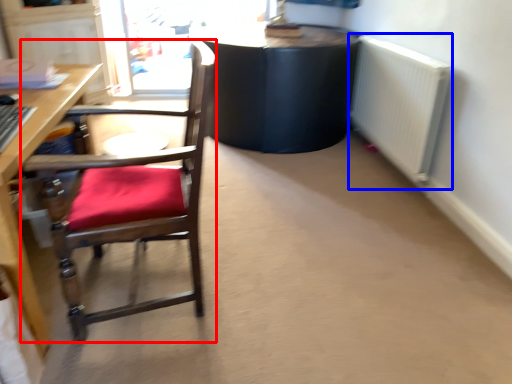
Question: Which of the following is the farthest to the observer, chair (highlighted by a red box) or radiator (highlighted by a blue box)?

Choices:
 (A) chair
 (B) radiator

Answer: (B)